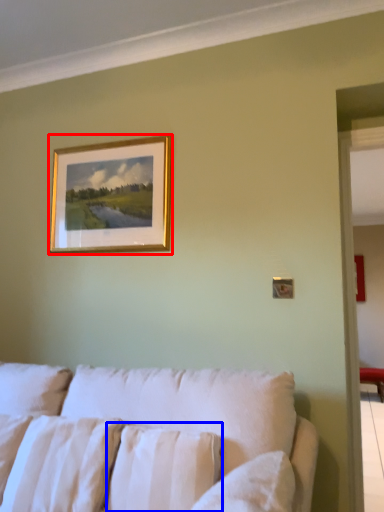
Question: Which point is closer to the camera, picture frame (highlighted by a red box) or pillow (highlighted by a blue box)?

Choices:
 (A) picture frame
 (B) pillow

Answer: (B)